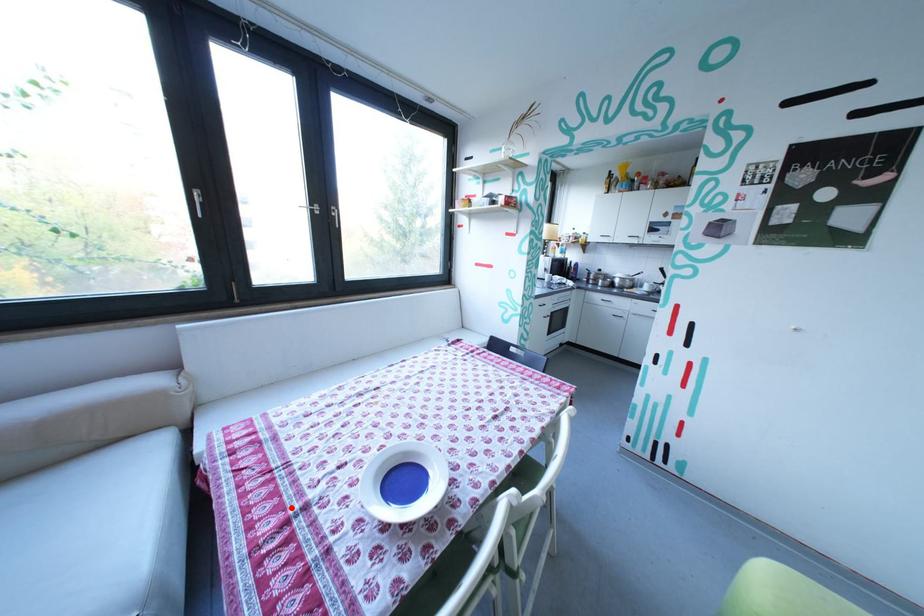
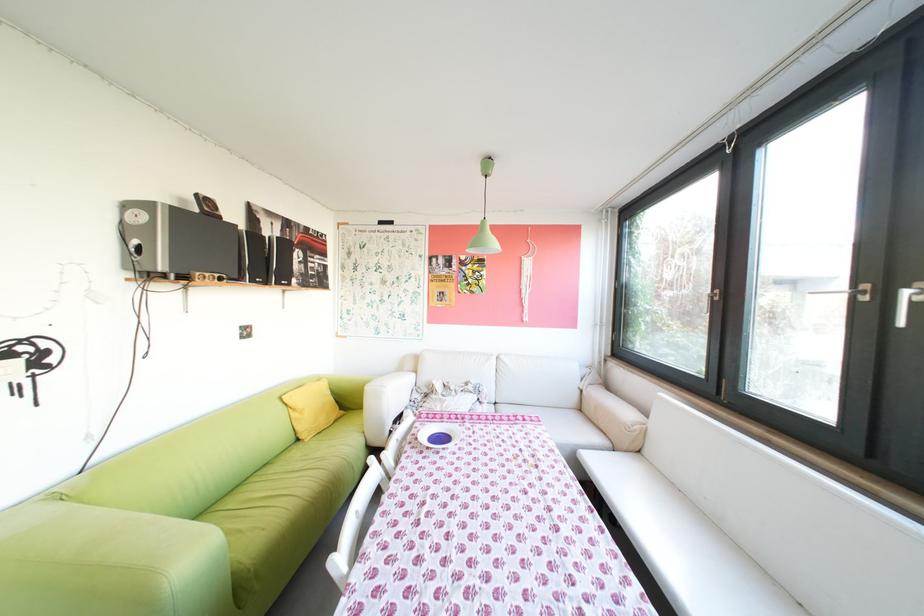
Question: A red point is marked in image1. In image2, is the corresponding 3D point closer to the camera or farther? Reply with the corresponding letter.

Choices:
 (A) The corresponding 3D point is closer.
 (B) The corresponding 3D point is farther.

Answer: (A)